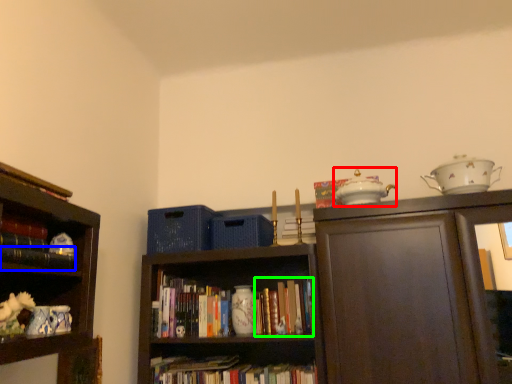
Question: Which object is the closest to the tea pot (highlighted by a red box)? Choose among these: book (highlighted by a blue box) or book (highlighted by a green box).

Choices:
 (A) book
 (B) book

Answer: (B)